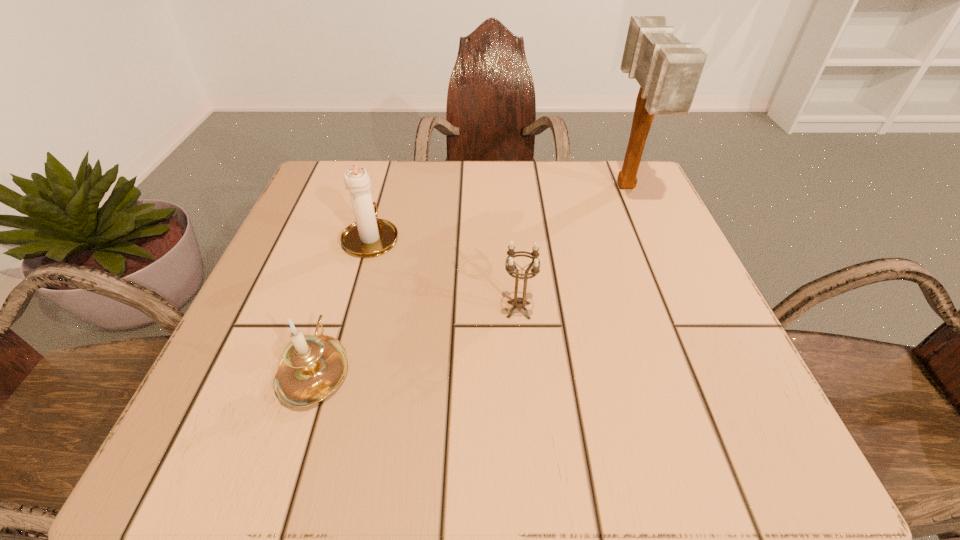
Choose which candle holder is the nearest neighbor to the tallest candle holder. Please provide its 2D coordinates. Your answer should be formatted as a tuple, i.e. [(x, y)], where the tuple contains the x and y coordinates of a point satisfying the conditions above.

[(312, 367)]

Identify which candle holder is the second closest to the rightmost candle holder. Please provide its 2D coordinates. Your answer should be formatted as a tuple, i.e. [(x, y)], where the tuple contains the x and y coordinates of a point satisfying the conditions above.

[(312, 367)]

The image size is (960, 540). Find the location of `free spot that satisfies the following two spatial constraints: 1. on the handle side of the rightmost object; 2. on the right side of the third shortest object`. free spot that satisfies the following two spatial constraints: 1. on the handle side of the rightmost object; 2. on the right side of the third shortest object is located at coordinates (386, 187).

You are a GUI agent. You are given a task and a screenshot of the screen. Output one action in this format:
    pyautogui.click(x=<x>, y=<y>)
    Task: Click on the vacant position in the image that satisfies the following two spatial constraints: 1. on the handle side of the nearest candle holder; 2. on the right side of the tallest object
    Image resolution: width=960 pixels, height=540 pixels.
    Given the screenshot: What is the action you would take?
    pyautogui.click(x=372, y=187)

The height and width of the screenshot is (540, 960). Find the location of `free location that satisfies the following two spatial constraints: 1. on the handle side of the nearest object; 2. on the right side of the mallet`. free location that satisfies the following two spatial constraints: 1. on the handle side of the nearest object; 2. on the right side of the mallet is located at coordinates (372, 187).

The height and width of the screenshot is (540, 960). In order to click on vacant space that satisfies the following two spatial constraints: 1. on the handle side of the tallest candle holder; 2. on the right side of the mallet in this screenshot , I will do (x=386, y=187).